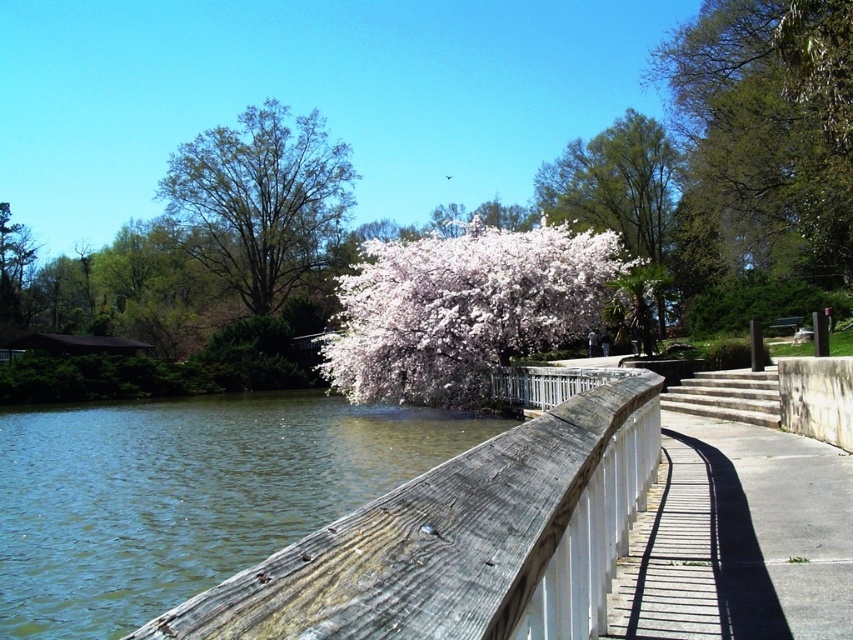
Question: Observing the image, what is the correct spatial positioning of white concrete pavement at lower right in reference to white blossoming tree at upper center?

Choices:
 (A) below
 (B) above

Answer: (A)

Question: Which of these objects is positioned farthest from the white concrete pavement at lower right?

Choices:
 (A) green leafy tree at upper left
 (B) white blossoming tree at upper center
 (C) weathered wood rail at center

Answer: (A)

Question: Estimate the real-world distances between objects in this image. Which object is farther from the weathered wood rail at center?

Choices:
 (A) white concrete pavement at lower right
 (B) green leafy tree at upper left
 (C) white blossoming tree at upper center

Answer: (B)

Question: Can you confirm if white concrete pavement at lower right is bigger than green leafy tree at upper left?

Choices:
 (A) yes
 (B) no

Answer: (B)

Question: Can you confirm if petal-like blossoms at center is smaller than white blossoming tree at upper center?

Choices:
 (A) yes
 (B) no

Answer: (A)

Question: Considering the real-world distances, which object is farthest from the white blossoming tree at upper center?

Choices:
 (A) green leafy tree at upper left
 (B) petal-like blossoms at center

Answer: (A)